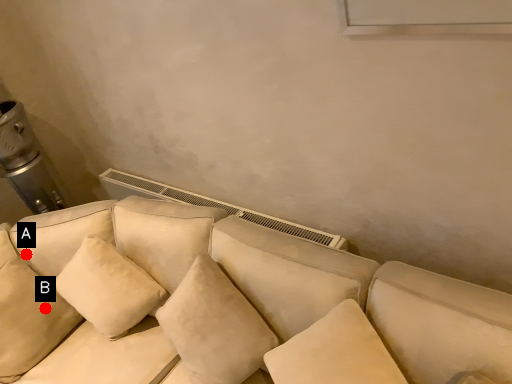
Question: Two points are circled on the image, labeled by A and B beside each circle. Which point appears closest to the camera in this image?

Choices:
 (A) A is closer
 (B) B is closer

Answer: (B)